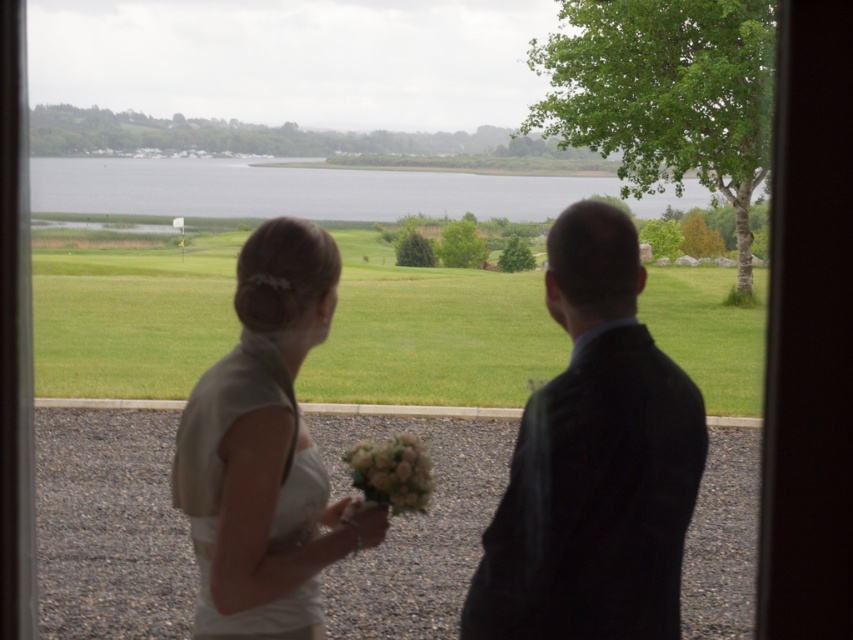
Which of these two, dark suit at center or white satin dress at left, stands taller?

dark suit at center is taller.

Who is more distant from viewer, (637,433) or (369,508)?

Positioned behind is point (369,508).

Image resolution: width=853 pixels, height=640 pixels. What are the coordinates of `dark suit at center` in the screenshot? It's located at (595, 461).

Between white satin dress at center and white satin dress at left, which one is positioned higher?

Positioned higher is white satin dress at center.

Between white satin dress at center and white satin dress at left, which one is positioned lower?

Positioned lower is white satin dress at left.

Image resolution: width=853 pixels, height=640 pixels. Identify the location of white satin dress at center. (595, 461).

Is green grassy field at center taller than white satin dress at left?

Yes.

Consider the image. Does green grassy field at center appear under white satin dress at left?

Actually, green grassy field at center is above white satin dress at left.

This screenshot has width=853, height=640. In order to click on green grassy field at center in this screenshot , I will do `click(431, 333)`.